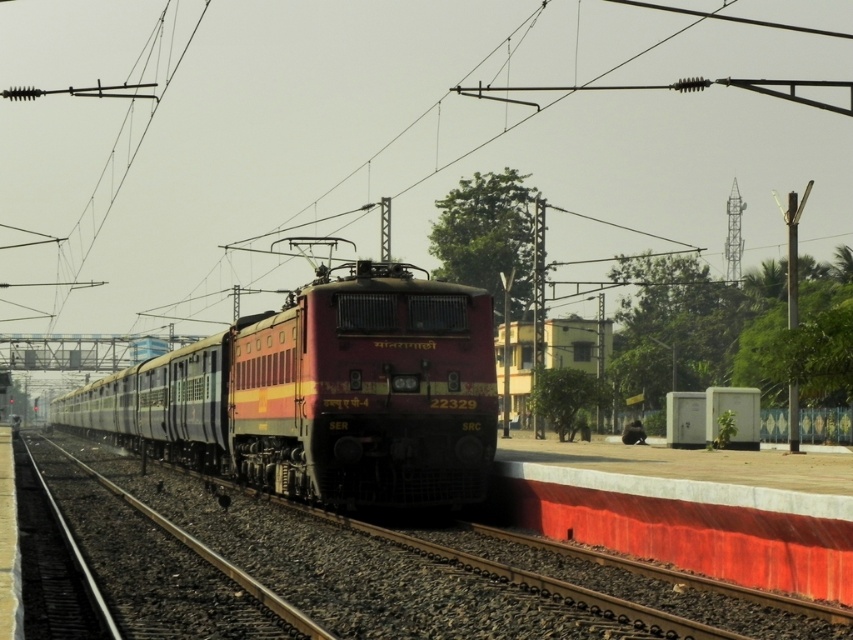
Which is more to the right, matte red locomotive at center or smooth metal train track at center?

Positioned to the right is smooth metal train track at center.

Is matte red locomotive at center taller than smooth metal train track at center?

Indeed, matte red locomotive at center has a greater height compared to smooth metal train track at center.

Where is `matte red locomotive at center`? This screenshot has height=640, width=853. matte red locomotive at center is located at coordinates (x=322, y=394).